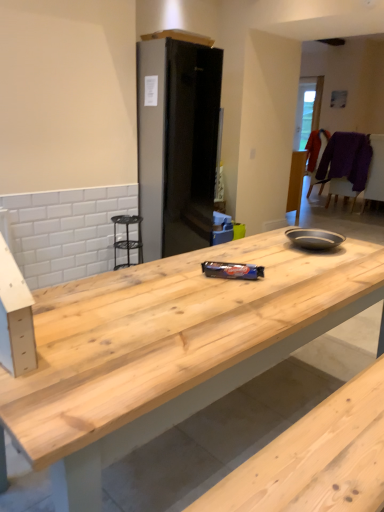
Question: From the image's perspective, would you say purple woolen sweater at right, which is the 1th chair in front-to-back order, is positioned over purple fabric chair at upper right, which is the first chair from back to front?

Choices:
 (A) yes
 (B) no

Answer: (B)

Question: Is purple woolen sweater at right, which is the 1th chair in front-to-back order, further to the viewer compared to purple fabric chair at upper right, which is the second chair from front to back?

Choices:
 (A) no
 (B) yes

Answer: (A)

Question: Are purple woolen sweater at right, the 2th chair when ordered from back to front, and purple fabric chair at upper right, which is the second chair from front to back, located far from each other?

Choices:
 (A) yes
 (B) no

Answer: (B)

Question: From a real-world perspective, is purple woolen sweater at right, which is the 1th chair in front-to-back order, on top of purple fabric chair at upper right, which is the first chair from back to front?

Choices:
 (A) yes
 (B) no

Answer: (B)

Question: Can you confirm if purple woolen sweater at right, which is the 1th chair in front-to-back order, is wider than purple fabric chair at upper right, which is the second chair from front to back?

Choices:
 (A) yes
 (B) no

Answer: (A)

Question: From the image's perspective, would you say purple woolen sweater at right, the 2th chair when ordered from back to front, is shown under purple fabric chair at upper right, which is the first chair from back to front?

Choices:
 (A) no
 (B) yes

Answer: (B)

Question: Is natural wood countertop at center at the left side of black matte refrigerator at center?

Choices:
 (A) no
 (B) yes

Answer: (A)

Question: From the image's perspective, is natural wood countertop at center located beneath black matte refrigerator at center?

Choices:
 (A) no
 (B) yes

Answer: (B)

Question: Is natural wood countertop at center not within black matte refrigerator at center?

Choices:
 (A) yes
 (B) no

Answer: (A)

Question: From a real-world perspective, is natural wood countertop at center located beneath black matte refrigerator at center?

Choices:
 (A) yes
 (B) no

Answer: (A)

Question: From a real-world perspective, is natural wood countertop at center physically above black matte refrigerator at center?

Choices:
 (A) no
 (B) yes

Answer: (A)

Question: Can you confirm if natural wood countertop at center is taller than black matte refrigerator at center?

Choices:
 (A) no
 (B) yes

Answer: (A)

Question: Is purple woolen sweater at right, the 2th chair when ordered from back to front, far from black matte refrigerator at center?

Choices:
 (A) no
 (B) yes

Answer: (B)